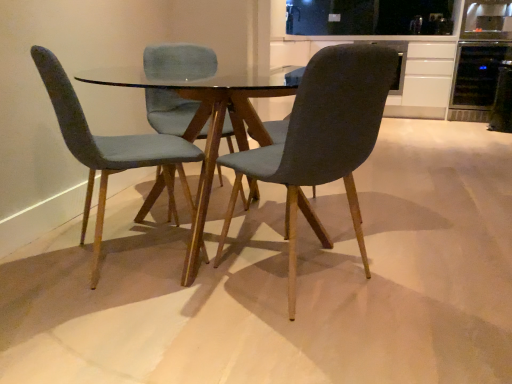
This screenshot has width=512, height=384. I want to click on free location to the left of velvet teal chair at left, arranged as the 2th chair when viewed from the right, so click(41, 266).